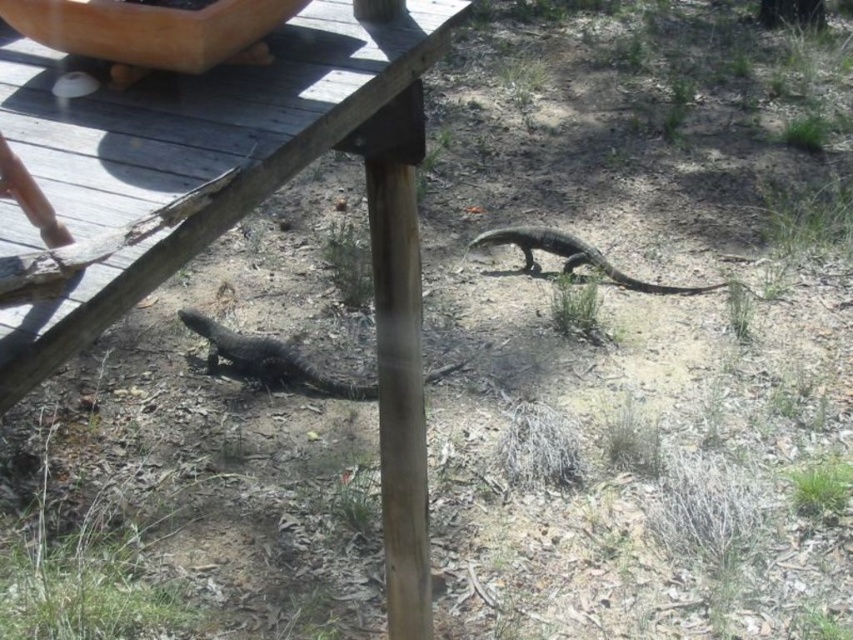
Does shiny black lizard at lower left have a smaller size compared to shiny black lizard at center?

Yes, shiny black lizard at lower left is smaller than shiny black lizard at center.

Can you confirm if shiny black lizard at lower left is positioned above shiny black lizard at center?

No, shiny black lizard at lower left is not above shiny black lizard at center.

Who is more distant from viewer, (x=281, y=384) or (x=529, y=240)?

The point (x=529, y=240) is more distant.

This screenshot has height=640, width=853. In order to click on shiny black lizard at lower left in this screenshot , I will do `click(267, 358)`.

Is wooden deck at lower left in front of shiny black lizard at center?

Yes, it is.

Does wooden deck at lower left have a smaller size compared to shiny black lizard at center?

Incorrect, wooden deck at lower left is not smaller in size than shiny black lizard at center.

Between point (379, 54) and point (712, 285), which one is positioned behind?

Positioned behind is point (712, 285).

Image resolution: width=853 pixels, height=640 pixels. Find the location of `wooden deck at lower left`. wooden deck at lower left is located at coordinates (245, 205).

Does wooden deck at lower left have a lesser width compared to shiny black lizard at lower left?

Yes, wooden deck at lower left is thinner than shiny black lizard at lower left.

Between point (241, 106) and point (337, 390), which one is positioned in front?

Point (241, 106) is in front.

Where is `wooden deck at lower left`? Image resolution: width=853 pixels, height=640 pixels. wooden deck at lower left is located at coordinates (245, 205).